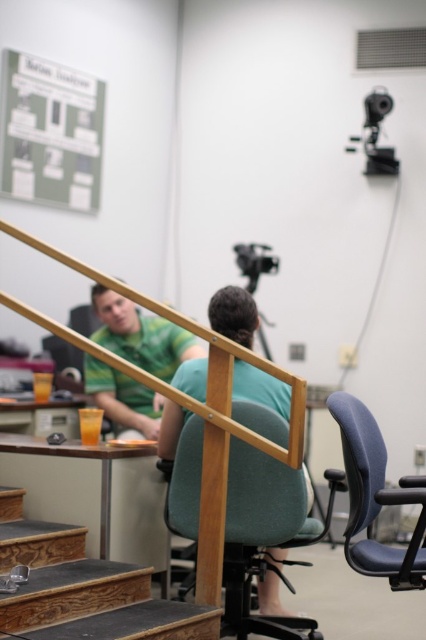
Is point (138, 605) farther from camera compared to point (385, 156)?

No, it is in front of (385, 156).

Does wooden stair at lower left have a larger size compared to black plastic video camera at upper right?

Indeed, wooden stair at lower left has a larger size compared to black plastic video camera at upper right.

Is point (14, 632) behind point (367, 138)?

No, (14, 632) is in front of (367, 138).

You are a GUI agent. You are given a task and a screenshot of the screen. Output one action in this format:
    pyautogui.click(x=<x>, y=<y>)
    Task: Click on the wooden stair at lower left
    This screenshot has height=640, width=426.
    Given the screenshot: What is the action you would take?
    pyautogui.click(x=83, y=588)

Between point (198, 624) and point (342, 428), which one is positioned behind?

The point (198, 624) is more distant.

Does wooden stair at lower left have a greater width compared to blue fabric swivel chair at right?

Correct, the width of wooden stair at lower left exceeds that of blue fabric swivel chair at right.

Between point (28, 634) and point (405, 564), which one is positioned behind?

Positioned behind is point (28, 634).

This screenshot has height=640, width=426. Find the location of `wooden stair at lower left`. wooden stair at lower left is located at coordinates (83, 588).

Is wooden stair at lower left smaller than green matte shirt at center?

Yes, wooden stair at lower left is smaller than green matte shirt at center.

Is wooden stair at lower left further to the viewer compared to green matte shirt at center?

No, it is in front of green matte shirt at center.

You are a GUI agent. You are given a task and a screenshot of the screen. Output one action in this format:
    pyautogui.click(x=<x>, y=<y>)
    Task: Click on the wooden stair at lower left
    The image size is (426, 640).
    Given the screenshot: What is the action you would take?
    pyautogui.click(x=83, y=588)